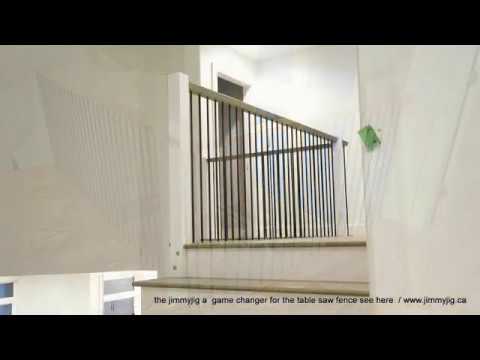
Image resolution: width=480 pixels, height=360 pixels. Identify the location of landing at top of stairs. (359, 235).